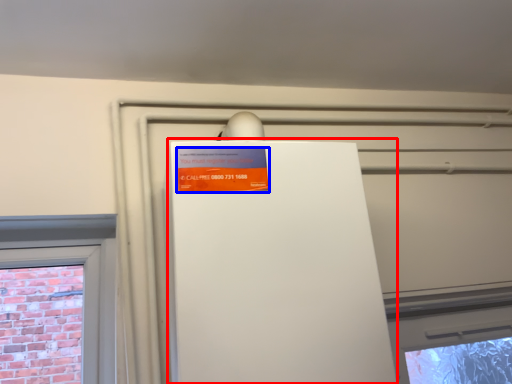
Question: Which object is further to the camera taking this photo, appliance (highlighted by a red box) or advertisement (highlighted by a blue box)?

Choices:
 (A) appliance
 (B) advertisement

Answer: (B)